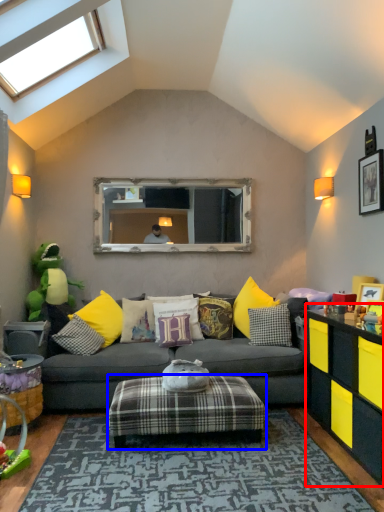
Question: Which of the following is the closest to the observer, cabinetry (highlighted by a red box) or stool (highlighted by a blue box)?

Choices:
 (A) cabinetry
 (B) stool

Answer: (A)